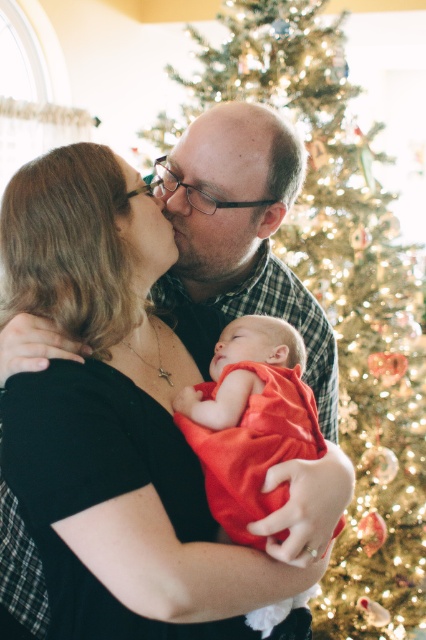
You are a photographer trying to capture the newborn baby in the center. You need to ensure the silky red swaddle at center and the matte black nose at center are both visible in the frame. Which object should you focus on to ensure both are in focus, given their size difference?

The silky red swaddle at center is larger in width than the matte black nose at center, so focusing on the larger object will help ensure both are in focus.

Based on the photo, you are a photographer trying to capture a closeup of the matte black glasses at center and the matte black nose at center in the scene. Based on their sizes, which object would require a wider angle to fit into the frame?

The matte black glasses at center might be wider than matte black nose at center, so it would require a wider angle to fit into the frame.

You are a photographer taking a picture of the black matte shirt at center and the matte black glasses at center. Which object should you focus on first if you want to ensure both are in focus, considering their positions?

The black matte shirt at center is much taller than the matte black glasses at center, so focusing on the black matte shirt at center first would help ensure both are in focus.